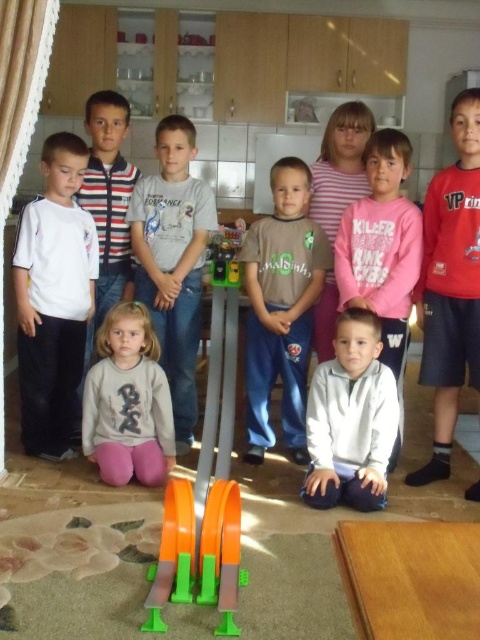
Question: Can you confirm if brown cotton shirt at center is positioned above orange plastic toy at center?

Choices:
 (A) yes
 (B) no

Answer: (A)

Question: Which of the following is the closest to the observer?

Choices:
 (A) (212, 493)
 (B) (59, 268)

Answer: (A)

Question: Which of the following is the farthest from the observer?

Choices:
 (A) (182, 177)
 (B) (422, 355)
 (C) (17, 253)
 (D) (206, 547)

Answer: (A)

Question: Estimate the real-world distances between objects in this image. Which object is farther from the red cotton shirt at right?

Choices:
 (A) pink cotton shirt at center
 (B) white cotton shirt at left
 (C) gray cotton shirt at center
 (D) gray matte sweatshirt at center

Answer: (B)

Question: Is red cotton shirt at right positioned at the back of striped cotton shirt at upper left?

Choices:
 (A) yes
 (B) no

Answer: (B)

Question: Does red cotton shirt at right have a smaller size compared to gray matte sweatshirt at center?

Choices:
 (A) no
 (B) yes

Answer: (A)